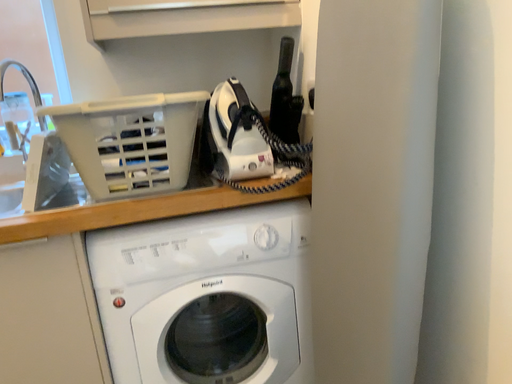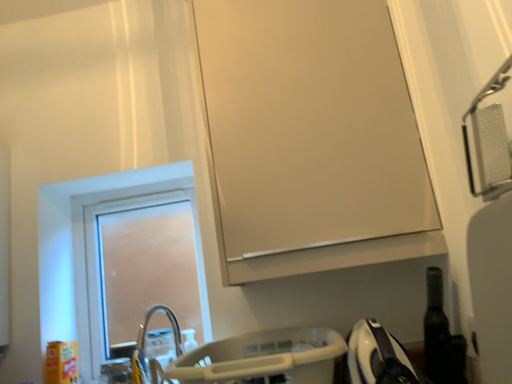
Question: How did the camera likely rotate when shooting the video?

Choices:
 (A) rotated left
 (B) rotated right

Answer: (A)